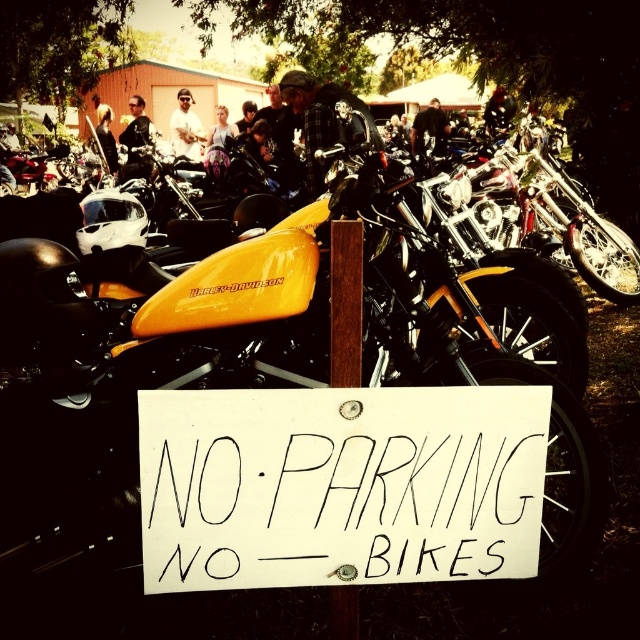
Consider the image. Who is higher up, white paper sign at center or wooden post at center?

wooden post at center

Is white paper sign at center positioned before wooden post at center?

Yes, it is.

Does point (330, 460) come behind point (344, 314)?

Yes, point (330, 460) is behind point (344, 314).

Where is `white paper sign at center`? The width and height of the screenshot is (640, 640). white paper sign at center is located at coordinates (339, 484).

Between white paper sign at center and yellowharley-davidson logo at center, which one is positioned higher?

yellowharley-davidson logo at center

Who is more distant from viewer, (189,522) or (248,280)?

The point (248,280) is more distant.

The height and width of the screenshot is (640, 640). What are the coordinates of `white paper sign at center` in the screenshot? It's located at (339, 484).

Can you confirm if wooden post at center is bigger than yellowharley-davidson logo at center?

Yes, wooden post at center is bigger than yellowharley-davidson logo at center.

Can you confirm if wooden post at center is positioned to the left of yellowharley-davidson logo at center?

In fact, wooden post at center is to the right of yellowharley-davidson logo at center.

Is point (355, 227) more distant than point (257, 282)?

That is False.

Locate an element on the screen. This screenshot has width=640, height=640. wooden post at center is located at coordinates (346, 301).